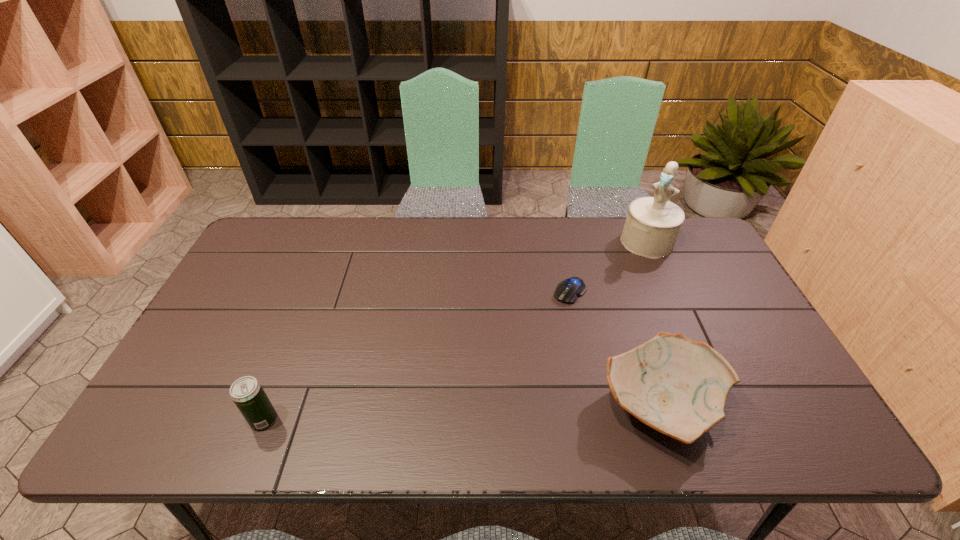
The image size is (960, 540). Identify the location of vacant space at the near edge of the desktop. (335, 400).

Identify the location of free space at the left edge of the desktop. The image size is (960, 540). (223, 299).

You are a GUI agent. You are given a task and a screenshot of the screen. Output one action in this format:
    pyautogui.click(x=<x>, y=<y>)
    Task: Click on the free space at the right edge
    Image resolution: width=960 pixels, height=540 pixels.
    Given the screenshot: What is the action you would take?
    pyautogui.click(x=705, y=307)

The width and height of the screenshot is (960, 540). I want to click on vacant region at the near left corner of the desktop, so click(171, 384).

This screenshot has height=540, width=960. What are the coordinates of `vacant area at the near right corner` in the screenshot? It's located at (753, 406).

Where is `vacant space in between the second farthest object and the pottery`? The height and width of the screenshot is (540, 960). vacant space in between the second farthest object and the pottery is located at coordinates (614, 349).

At what (x,y) coordinates should I click in order to perform the action: click on vacant region between the beer can and the computer mouse. Please return your answer as a coordinate pair (x, y). The image size is (960, 540). Looking at the image, I should click on (417, 356).

Find the location of a particular element. free space between the pottery and the tallest object is located at coordinates (654, 324).

The height and width of the screenshot is (540, 960). Find the location of `unoccupied area between the tallest object and the leftmost object`. unoccupied area between the tallest object and the leftmost object is located at coordinates (455, 331).

The width and height of the screenshot is (960, 540). I want to click on vacant space that's between the shortest object and the beer can, so click(x=417, y=356).